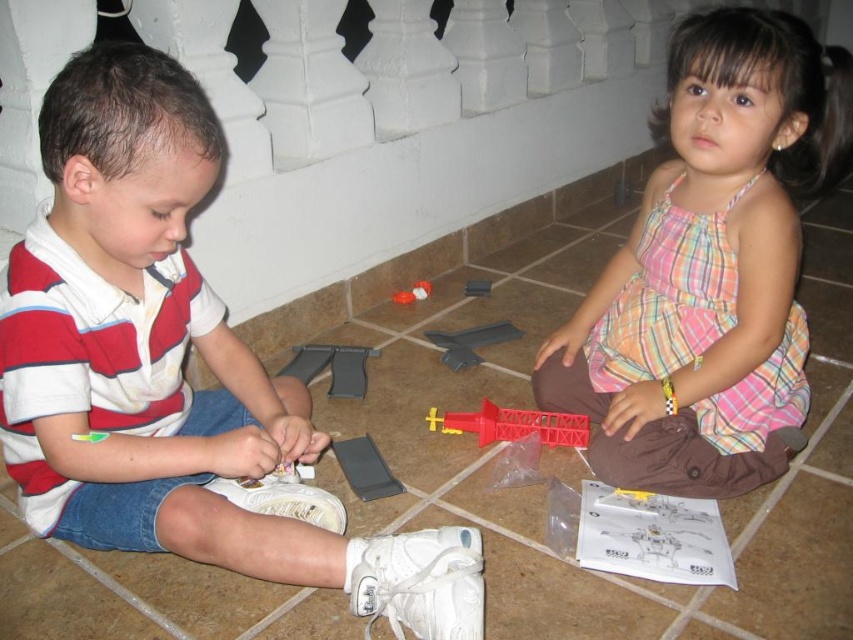
Is pink plaid dress at center closer to camera compared to red plastic toy at center?

Yes, pink plaid dress at center is in front of red plastic toy at center.

The image size is (853, 640). Describe the element at coordinates (711, 268) in the screenshot. I see `pink plaid dress at center` at that location.

This screenshot has height=640, width=853. I want to click on pink plaid dress at center, so click(711, 268).

Can you confirm if red plastic tower at center is positioned below red plastic toy at center?

Indeed, red plastic tower at center is positioned under red plastic toy at center.

Is point (465, 426) positioned after point (476, 291)?

No, it is in front of (476, 291).

Identify the location of red plastic tower at center. (514, 424).

What are the coordinates of `red plastic tower at center` in the screenshot? It's located at (514, 424).

Between pink plaid dress at center and translucent plastic toy at center, which one has more height?

pink plaid dress at center

Does pink plaid dress at center appear on the right side of translucent plastic toy at center?

Indeed, pink plaid dress at center is positioned on the right side of translucent plastic toy at center.

Where is `pink plaid dress at center`? The width and height of the screenshot is (853, 640). pink plaid dress at center is located at coordinates (711, 268).

In order to click on pink plaid dress at center in this screenshot , I will do `click(711, 268)`.